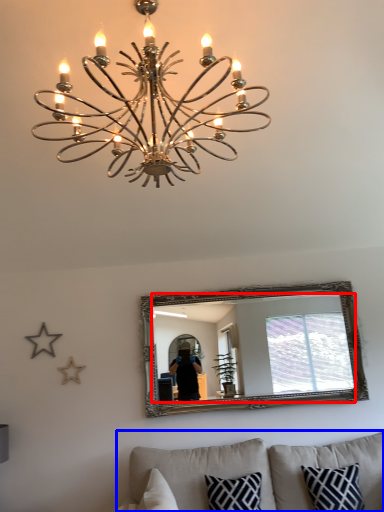
Question: Which object appears farthest to the camera in this image, mirror (highlighted by a red box) or studio couch (highlighted by a blue box)?

Choices:
 (A) mirror
 (B) studio couch

Answer: (A)